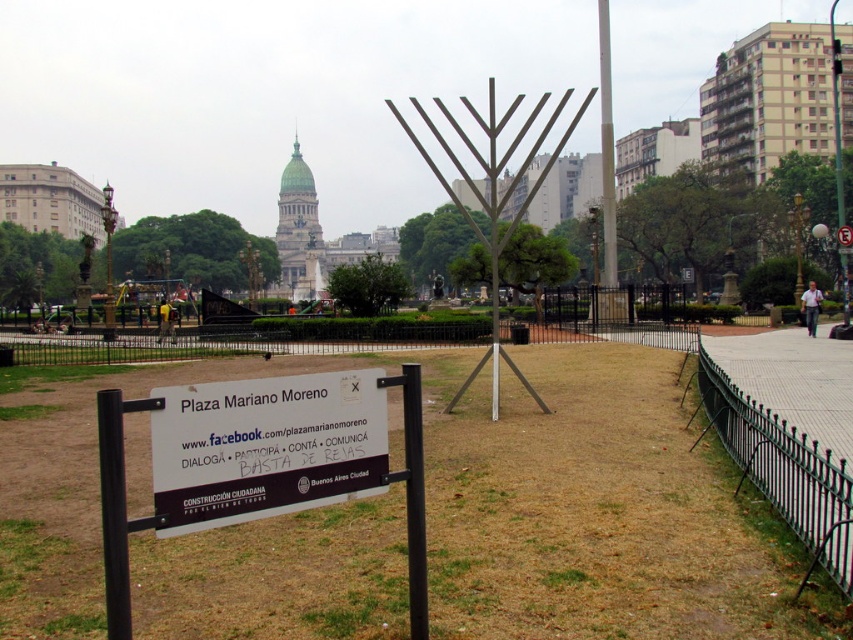
Between black wrought iron fence at right and brushed metal pole at upper right, which one has less height?

Standing shorter between the two is black wrought iron fence at right.

Does black wrought iron fence at right have a larger size compared to brushed metal pole at upper right?

No, black wrought iron fence at right is not bigger than brushed metal pole at upper right.

What are the coordinates of `black wrought iron fence at right` in the screenshot? It's located at (784, 470).

Measure the distance between point (355, 419) and camera.

They are 4.93 meters apart.

Between point (364, 422) and point (839, 100), which one is positioned in front?

Positioned in front is point (364, 422).

Is point (287, 465) positioned before point (828, 38)?

Yes, it is.

The height and width of the screenshot is (640, 853). What are the coordinates of `white plastic sign at center` in the screenshot? It's located at (265, 448).

Who is positioned more to the right, black wrought iron fence at right or metallic silver menorah at center?

metallic silver menorah at center is more to the right.

Based on the photo, can you confirm if black wrought iron fence at right is shorter than metallic silver menorah at center?

Indeed, black wrought iron fence at right has a lesser height compared to metallic silver menorah at center.

Between point (726, 380) and point (511, 364), which one is positioned behind?

Positioned behind is point (511, 364).

What are the coordinates of `black wrought iron fence at right` in the screenshot? It's located at (784, 470).